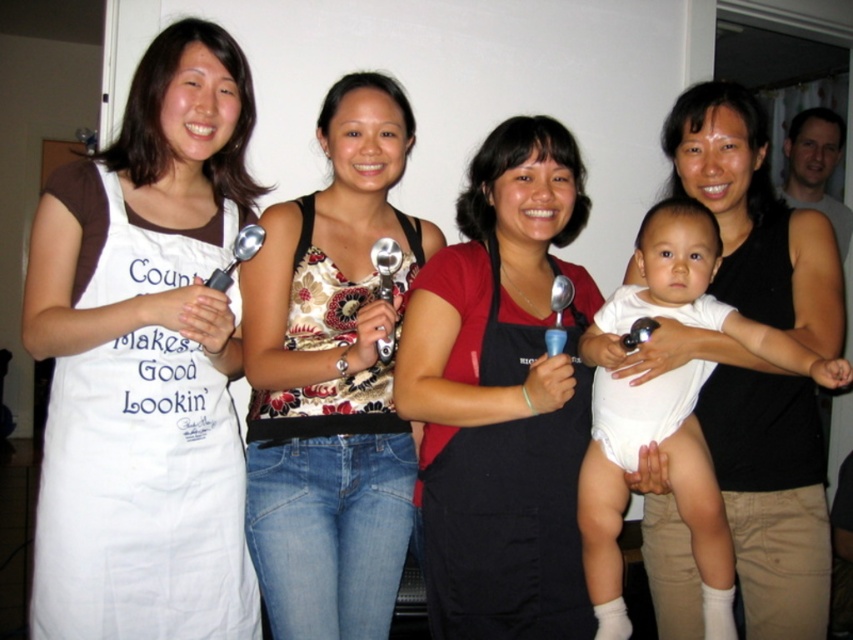
Is point (468, 618) less distant than point (703, 269)?

Yes, it is.

Is black matte apron at center shorter than white cloth diaper at center?

Yes, black matte apron at center is shorter than white cloth diaper at center.

Is point (518, 492) positioned behind point (811, 368)?

Yes, point (518, 492) is behind point (811, 368).

The height and width of the screenshot is (640, 853). What are the coordinates of `black matte apron at center` in the screenshot? It's located at (509, 513).

Where is `floral fabric tank top at center`? This screenshot has height=640, width=853. floral fabric tank top at center is located at coordinates (332, 380).

Is floral fabric tank top at center bigger than white cotton apron at left?

Correct, floral fabric tank top at center is larger in size than white cotton apron at left.

Between point (322, 189) and point (169, 420), which one is positioned in front?

Positioned in front is point (169, 420).

Identify the location of floral fabric tank top at center. This screenshot has width=853, height=640. (332, 380).

Is white cotton apron at left further to the viewer compared to white cloth diaper at center?

Yes, it is behind white cloth diaper at center.

Can you confirm if white cotton apron at left is positioned to the right of white cloth diaper at center?

No, white cotton apron at left is not to the right of white cloth diaper at center.

Between point (80, 448) and point (693, 452), which one is positioned behind?

The point (693, 452) is more distant.

Where is `white cotton apron at left`? This screenshot has height=640, width=853. white cotton apron at left is located at coordinates (141, 499).